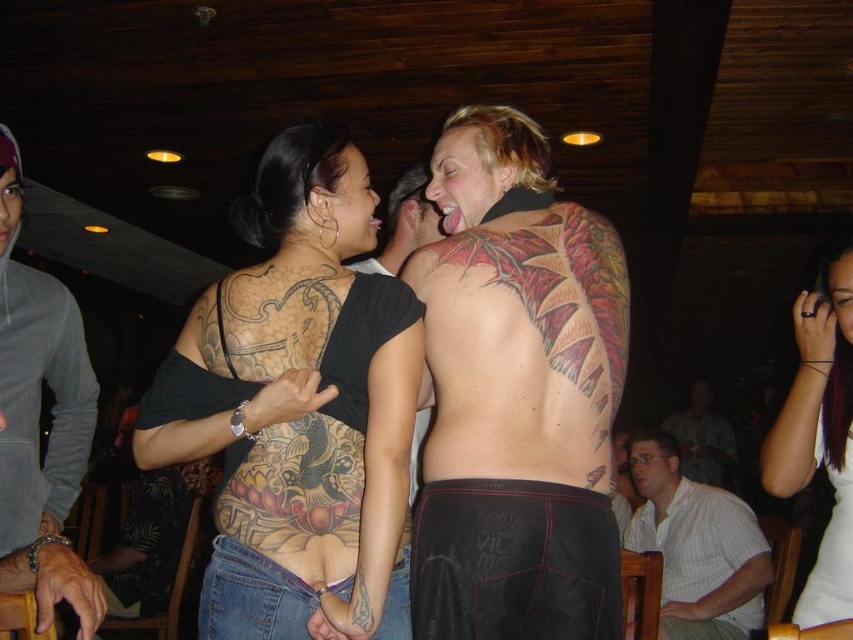
Where is `purple hair at upper right`? Image resolution: width=853 pixels, height=640 pixels. purple hair at upper right is located at coordinates (819, 433).

Is purple hair at upper right to the left of white striped shirt at lower right from the viewer's perspective?

Correct, you'll find purple hair at upper right to the left of white striped shirt at lower right.

At what (x,y) coordinates should I click in order to perform the action: click on purple hair at upper right. Please return your answer as a coordinate pair (x, y). This screenshot has width=853, height=640. Looking at the image, I should click on (819, 433).

What do you see at coordinates (38, 422) in the screenshot? This screenshot has height=640, width=853. I see `matte black tank top at center` at bounding box center [38, 422].

Looking at this image, is matte black tank top at center above light brown wood chair at lower right?

Yes, matte black tank top at center is above light brown wood chair at lower right.

Who is more forward, (56,396) or (695,385)?

Point (56,396) is more forward.

Find the location of `matte black tank top at center`. matte black tank top at center is located at coordinates (38, 422).

Does white striped shirt at lower right have a smaller size compared to dark brown skin tattoo at upper center?

Incorrect, white striped shirt at lower right is not smaller in size than dark brown skin tattoo at upper center.

Which is in front, point (682, 588) or point (386, 540)?

Positioned in front is point (386, 540).

At what (x,y) coordinates should I click in order to perform the action: click on white striped shirt at lower right. Please return your answer as a coordinate pair (x, y). Looking at the image, I should click on (695, 547).